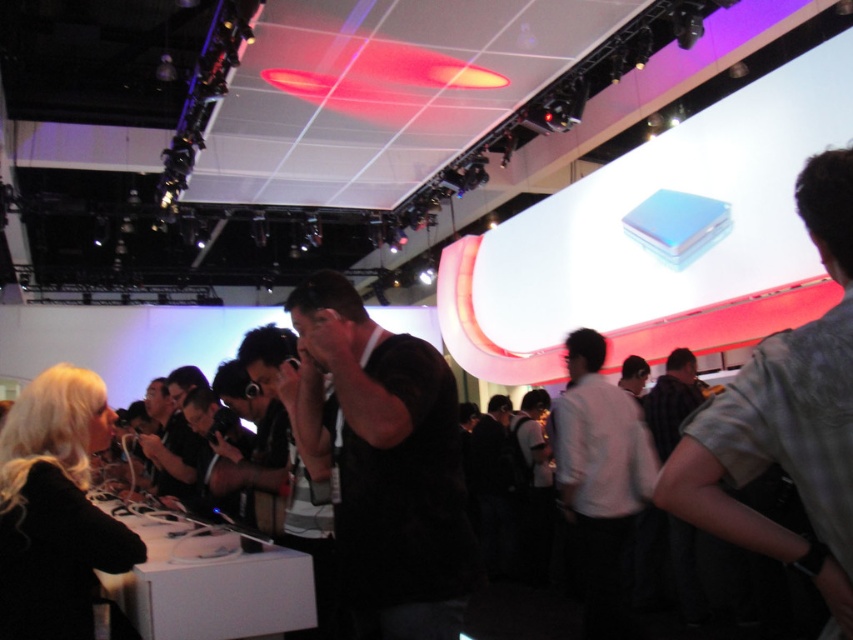
Question: Can you confirm if white matte shirt at center is smaller than dark brown leather jacket at center?

Choices:
 (A) no
 (B) yes

Answer: (A)

Question: Among these objects, which one is nearest to the camera?

Choices:
 (A) dark brown leather jacket at center
 (B) white matte shirt at center
 (C) gray fabric shirt at right

Answer: (C)

Question: Observing the image, what is the correct spatial positioning of gray fabric shirt at right in reference to white matte shirt at center?

Choices:
 (A) above
 (B) below

Answer: (A)

Question: Does gray fabric shirt at right lie behind dark brown leather jacket at center?

Choices:
 (A) yes
 (B) no

Answer: (B)

Question: Which object appears closest to the camera in this image?

Choices:
 (A) gray fabric shirt at right
 (B) white matte shirt at center

Answer: (A)

Question: Which of the following is the farthest from the observer?

Choices:
 (A) dark brown leather jacket at center
 (B) white matte shirt at center
 (C) black matte shirt at center
 (D) gray fabric shirt at right

Answer: (A)